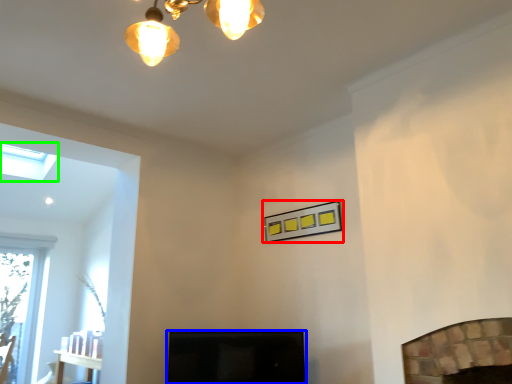
Question: Which object is positioned farthest from picture frame (highlighted by a red box)? Select from screen door (highlighted by a blue box) and lamp (highlighted by a green box).

Choices:
 (A) screen door
 (B) lamp

Answer: (B)